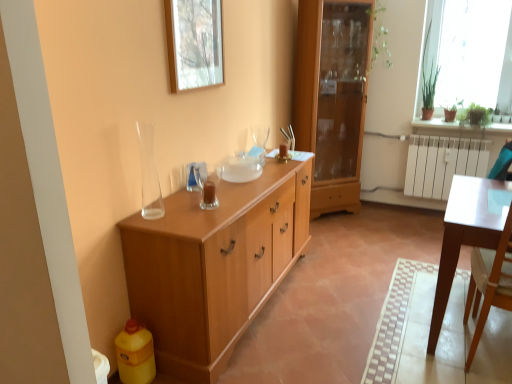
Locate an element on the screen. The width and height of the screenshot is (512, 384). vacant space behind translucent glass candle at center is located at coordinates (216, 191).